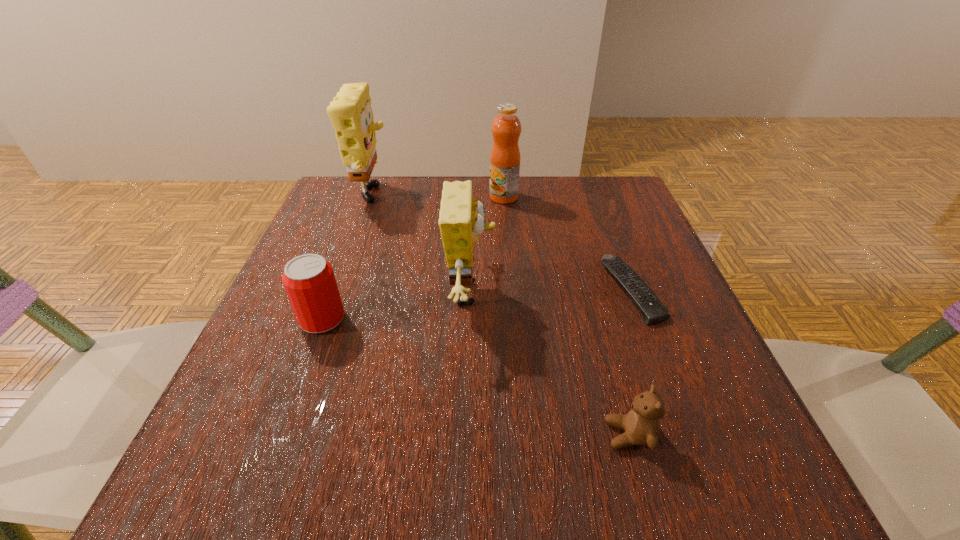
Locate an element on the screen. This screenshot has height=540, width=960. free space at the far left corner of the desktop is located at coordinates (393, 179).

In the image, there is a desktop. Where is `free space at the far right corner`? The image size is (960, 540). free space at the far right corner is located at coordinates (598, 179).

Locate an element on the screen. free spot at the near right corner of the desktop is located at coordinates (667, 459).

Identify the location of vacant area that lies between the remote control and the nearest object. (630, 362).

Identify the location of free space between the second object from right to left and the shortest object. (630, 362).

The height and width of the screenshot is (540, 960). Identify the location of free space between the third shortest object and the fruit juice. (413, 258).

Find the location of `free space that is in between the shortest object and the fifth tallest object`. free space that is in between the shortest object and the fifth tallest object is located at coordinates (630, 362).

The height and width of the screenshot is (540, 960). I want to click on free space between the fruit juice and the left sponge, so click(x=438, y=198).

Locate an element on the screen. vacant region between the shortest object and the shorter sponge is located at coordinates (551, 292).

In order to click on free point between the farther sponge and the right sponge in this screenshot , I will do [421, 246].